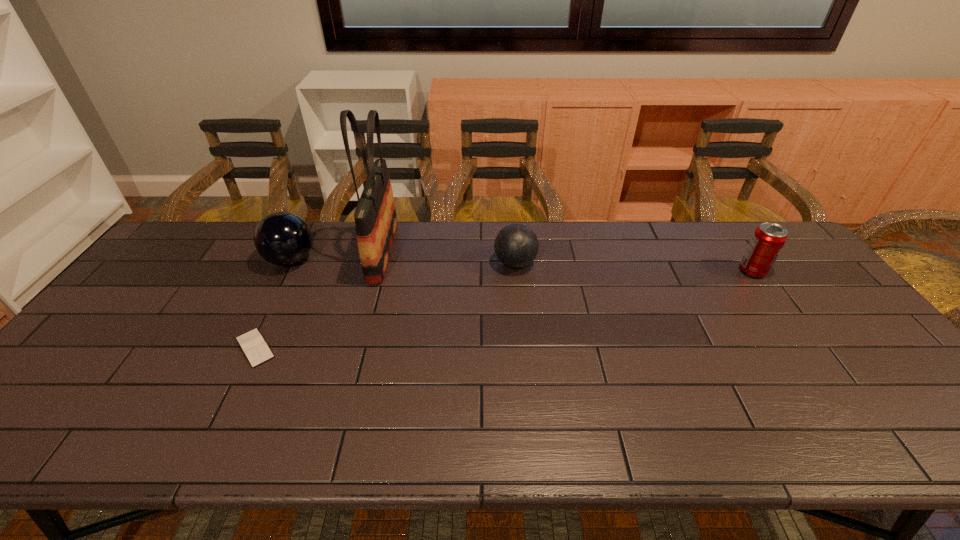
Find the location of `the third object from left to right`. the third object from left to right is located at coordinates (375, 217).

Locate an element on the screen. Image resolution: width=960 pixels, height=540 pixels. shopping bag is located at coordinates (375, 217).

Where is `the taller bowling ball`? the taller bowling ball is located at coordinates (281, 238).

The image size is (960, 540). In order to click on soda can in this screenshot , I will do `click(768, 239)`.

Locate an element on the screen. the shorter bowling ball is located at coordinates (516, 245).

Where is `the right bowling ball`? This screenshot has width=960, height=540. the right bowling ball is located at coordinates (516, 245).

This screenshot has width=960, height=540. In order to click on the shortest object in this screenshot , I will do `click(253, 345)`.

Locate an element on the screen. diary is located at coordinates (253, 345).

Find the location of a particular element. The width and height of the screenshot is (960, 540). free region located on the front-facing side of the shopping bag is located at coordinates coord(481,252).

Image resolution: width=960 pixels, height=540 pixels. I want to click on free space located on the side of the taller bowling ball with the finger holes, so click(336, 260).